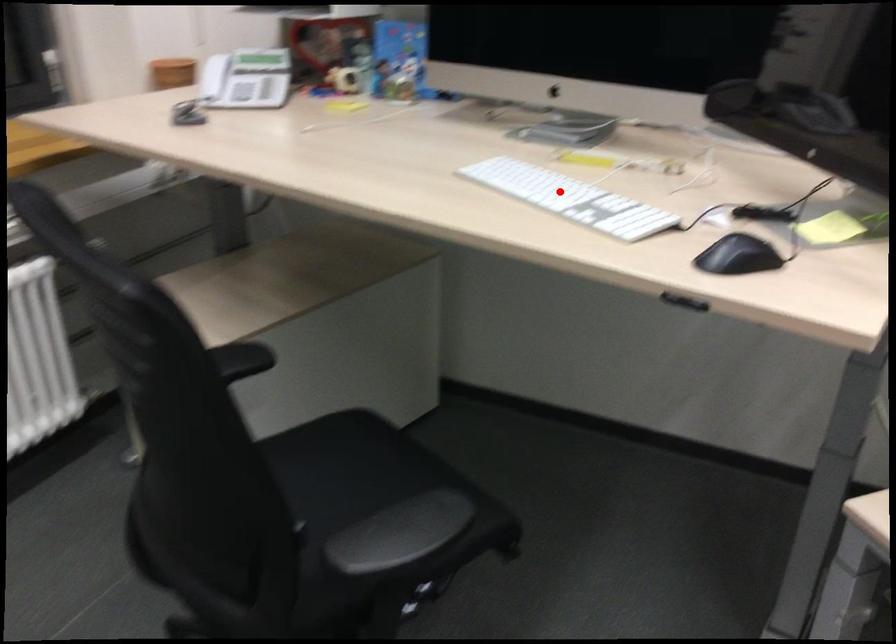
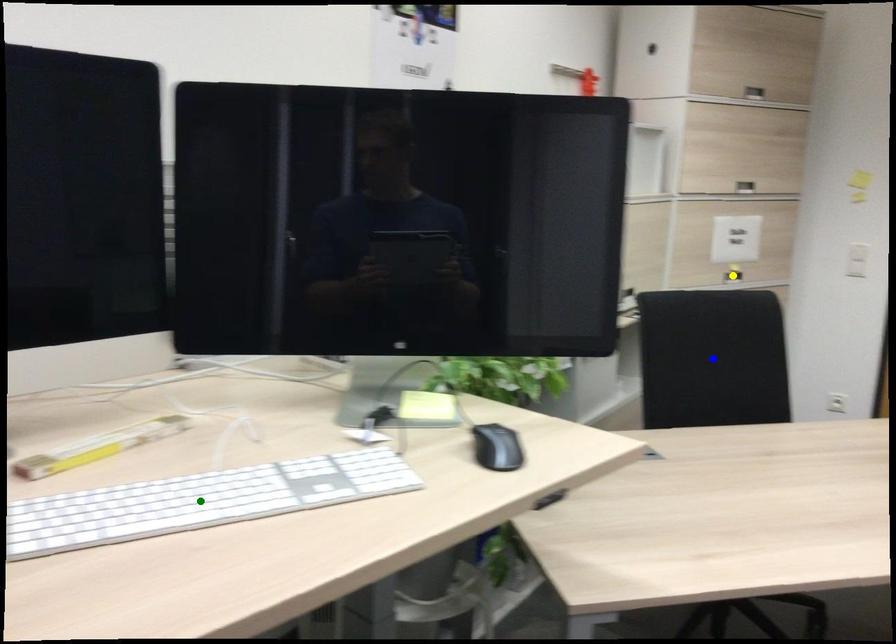
Question: I am providing you with two images of the same scene from different viewpoints. A red point is marked on the first image. You are given multiple points on the second image. Which mark in image 2 goes with the point in image 1?

Choices:
 (A) yellow point
 (B) blue point
 (C) green point

Answer: (C)